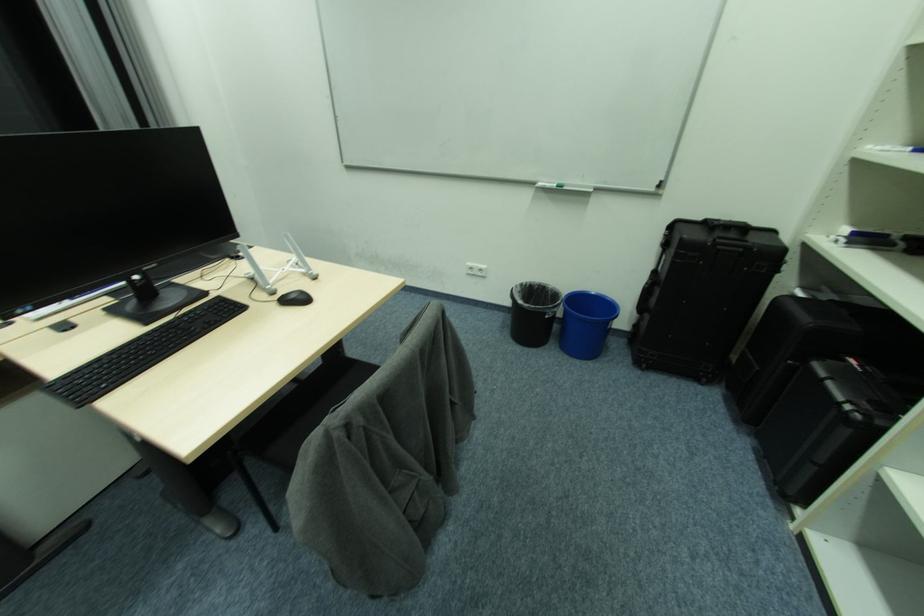
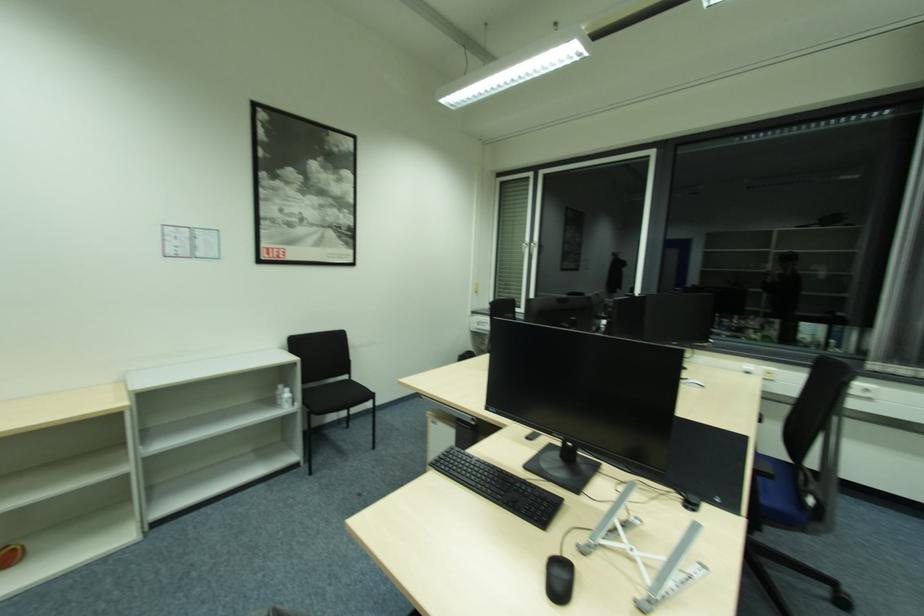
How did the camera likely rotate?

The camera's rotation is toward left-down.